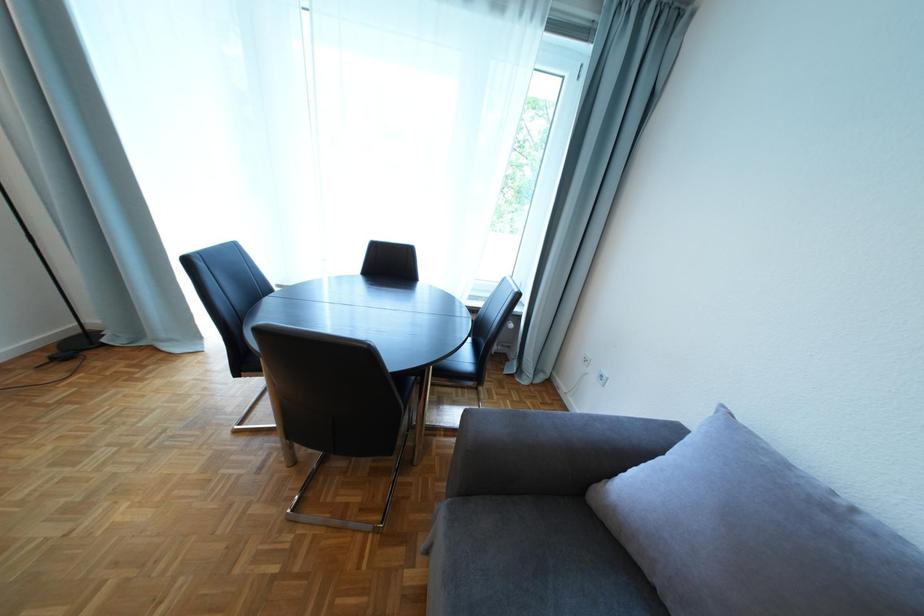
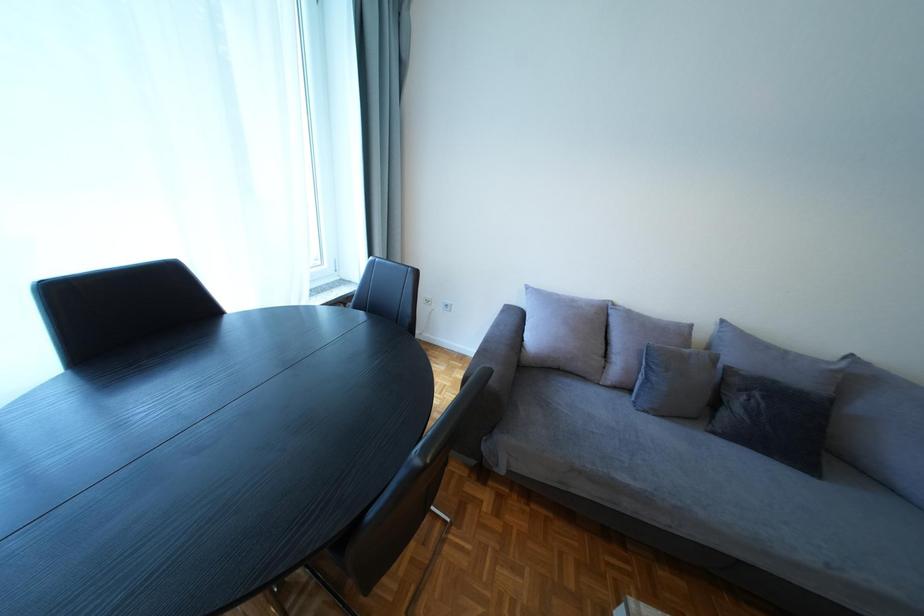
The first image is from the beginning of the video and the second image is from the end. How did the camera likely rotate when shooting the video?

The camera rotated toward right-down.